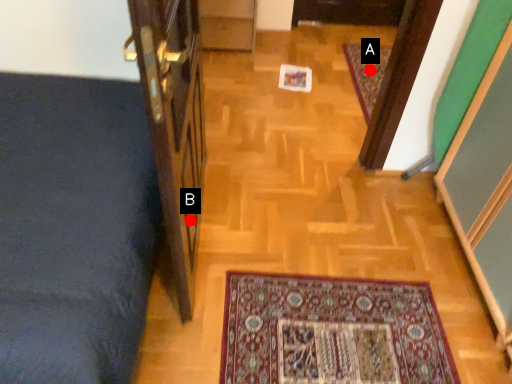
Question: Two points are circled on the image, labeled by A and B beside each circle. Which point appears closest to the camera in this image?

Choices:
 (A) A is closer
 (B) B is closer

Answer: (B)